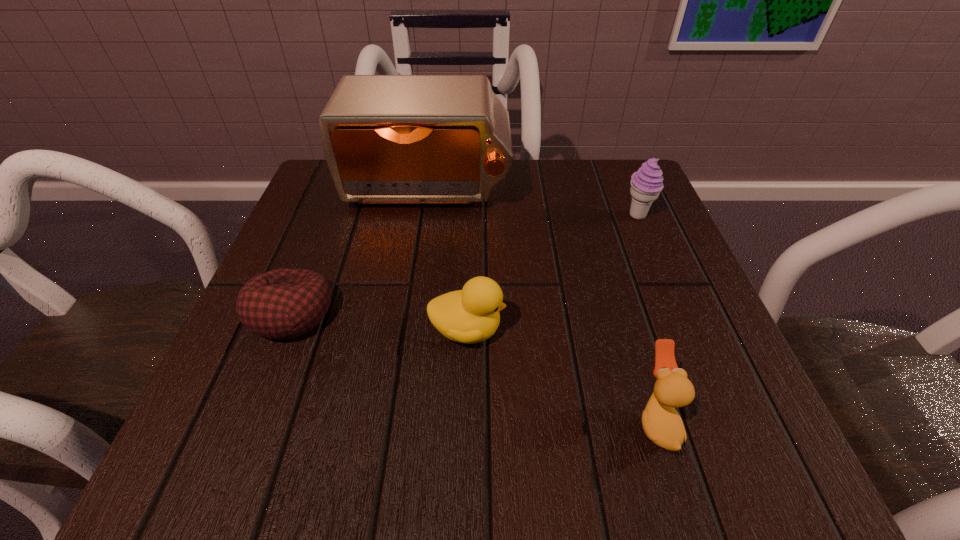
Where is `the tallest object`? The width and height of the screenshot is (960, 540). the tallest object is located at coordinates (387, 139).

Locate an element on the screen. The image size is (960, 540). the rightmost object is located at coordinates (646, 184).

Locate an element on the screen. Image resolution: width=960 pixels, height=540 pixels. the second tallest object is located at coordinates tap(646, 184).

You are a GUI agent. You are given a task and a screenshot of the screen. Output one action in this format:
    pyautogui.click(x=<x>, y=<y>)
    Task: Click on the farther duck
    
    Given the screenshot: What is the action you would take?
    pyautogui.click(x=471, y=315)

Where is `the fourth object from left to right`? The image size is (960, 540). the fourth object from left to right is located at coordinates (662, 424).

Locate an element on the screen. the nearest object is located at coordinates (662, 424).

At what (x,y) coordinates should I click in order to perform the action: click on the shortest object. Please return your answer as a coordinate pair (x, y). This screenshot has height=540, width=960. Looking at the image, I should click on (281, 304).

This screenshot has width=960, height=540. In order to click on vacant area located 0.140m on the door side of the toaster oven in this screenshot , I will do `click(416, 268)`.

Locate an element on the screen. This screenshot has height=540, width=960. free location located 0.240m on the front of the rightmost object is located at coordinates (681, 319).

The image size is (960, 540). I want to click on vacant area situated on the front-facing side of the farther duck, so click(613, 330).